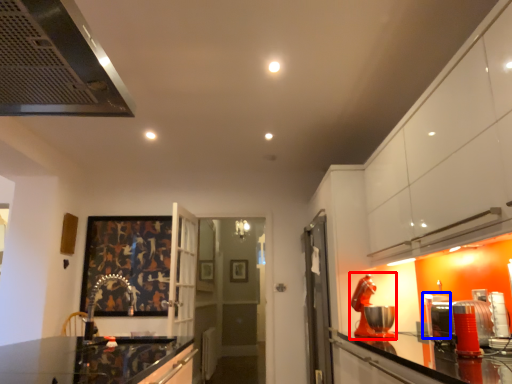
Question: Among these objects, which one is nearest to the camera, appliance (highlighted by a red box) or appliance (highlighted by a blue box)?

Choices:
 (A) appliance
 (B) appliance

Answer: (A)